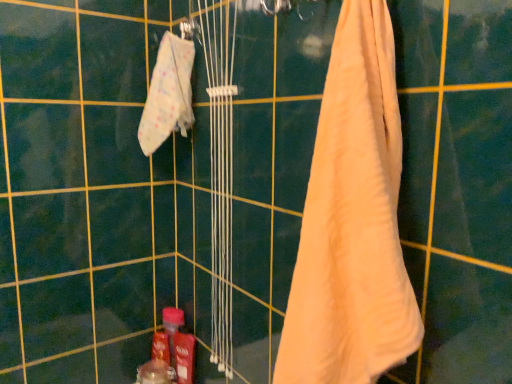
You are a GUI agent. You are given a task and a screenshot of the screen. Output one action in this format:
    pyautogui.click(x=<x>, y=<y>)
    Task: Click on the beige cotton towel at right, the 1th towel positioned from the right
    The image size is (512, 384).
    Given the screenshot: What is the action you would take?
    pyautogui.click(x=352, y=221)

Locate an element on the screen. The image size is (512, 384). white fabric towel at upper left, marked as the 1th towel in a back-to-front arrangement is located at coordinates (168, 94).

At what (x,y) coordinates should I click in order to perform the action: click on translucent plastic bottle at lower center. Please return your answer as a coordinate pair (x, y). The height and width of the screenshot is (384, 512). Looking at the image, I should click on (172, 327).

Measure the distance between point (183, 319) and camera.

Point (183, 319) and camera are 4.82 feet apart.

The image size is (512, 384). I want to click on beige cotton towel at right, which is the second towel in back-to-front order, so click(x=352, y=221).

Considering the relative sizes of beige cotton towel at right, acting as the 1th towel starting from the front, and white fabric towel at upper left, which is the second towel from front to back, in the image provided, is beige cotton towel at right, acting as the 1th towel starting from the front, bigger than white fabric towel at upper left, which is the second towel from front to back,?

Correct, beige cotton towel at right, acting as the 1th towel starting from the front, is larger in size than white fabric towel at upper left, which is the second towel from front to back.

From a real-world perspective, is beige cotton towel at right, acting as the 1th towel starting from the front, on top of white fabric towel at upper left, which is the second towel from front to back?

No, from a real-world perspective, beige cotton towel at right, acting as the 1th towel starting from the front, is not above white fabric towel at upper left, which is the second towel from front to back.

Image resolution: width=512 pixels, height=384 pixels. There is a translucent plastic bottle at lower center. What are the coordinates of `the 2nd towel above it (from a real-world perspective)` in the screenshot? It's located at (168, 94).

Is white fabric towel at upper left, which is the second towel from front to back, with translucent plastic bottle at lower center?

white fabric towel at upper left, which is the second towel from front to back, and translucent plastic bottle at lower center are clearly separated.

Consider the image. Is white fabric towel at upper left, which is the second towel from front to back, situated inside translucent plastic bottle at lower center or outside?

white fabric towel at upper left, which is the second towel from front to back, lies outside translucent plastic bottle at lower center.

Considering the relative sizes of white fabric towel at upper left, marked as the 1th towel in a back-to-front arrangement, and translucent plastic bottle at lower center in the image provided, is white fabric towel at upper left, marked as the 1th towel in a back-to-front arrangement, bigger than translucent plastic bottle at lower center?

Yes.

Who is taller, translucent plastic bottle at lower center or beige cotton towel at right, which is the 2th towel from left to right?

Standing taller between the two is beige cotton towel at right, which is the 2th towel from left to right.

From a real-world perspective, is translucent plastic bottle at lower center on top of beige cotton towel at right, which is the second towel in back-to-front order?

Actually, translucent plastic bottle at lower center is physically below beige cotton towel at right, which is the second towel in back-to-front order, in the real world.

Is translucent plastic bottle at lower center next to beige cotton towel at right, the 1th towel positioned from the right?

No.

Can you tell me how much translucent plastic bottle at lower center and beige cotton towel at right, which is the second towel in back-to-front order, differ in facing direction?

translucent plastic bottle at lower center and beige cotton towel at right, which is the second towel in back-to-front order, are facing 92 degrees away from each other.

In the image, is beige cotton towel at right, acting as the 1th towel starting from the front, positioned in front of or behind translucent plastic bottle at lower center?

Clearly, beige cotton towel at right, acting as the 1th towel starting from the front, is in front of translucent plastic bottle at lower center.

Is beige cotton towel at right, acting as the 1th towel starting from the front, positioned beyond the bounds of translucent plastic bottle at lower center?

beige cotton towel at right, acting as the 1th towel starting from the front, lies outside translucent plastic bottle at lower center's area.

Is beige cotton towel at right, which is the second towel in back-to-front order, positioned far away from translucent plastic bottle at lower center?

No, there isn't a large distance between beige cotton towel at right, which is the second towel in back-to-front order, and translucent plastic bottle at lower center.

Consider the image. Is white fabric towel at upper left, marked as the 1th towel in a back-to-front arrangement, at the right side of beige cotton towel at right, acting as the 1th towel starting from the front?

Incorrect, white fabric towel at upper left, marked as the 1th towel in a back-to-front arrangement, is not on the right side of beige cotton towel at right, acting as the 1th towel starting from the front.

Is white fabric towel at upper left, positioned as the first towel in left-to-right order, not close to beige cotton towel at right, which is the 2th towel from left to right?

No, white fabric towel at upper left, positioned as the first towel in left-to-right order, is in close proximity to beige cotton towel at right, which is the 2th towel from left to right.

Is beige cotton towel at right, which is the 2th towel from left to right, completely or partially inside white fabric towel at upper left, which is the second towel from front to back?

No, beige cotton towel at right, which is the 2th towel from left to right, is not surrounded by white fabric towel at upper left, which is the second towel from front to back.

Is point (160, 88) less distant than point (402, 331)?

No, (160, 88) is further to viewer.

Is translucent plastic bottle at lower center located outside white fabric towel at upper left, marked as the 1th towel in a back-to-front arrangement?

Yes, translucent plastic bottle at lower center is located beyond the bounds of white fabric towel at upper left, marked as the 1th towel in a back-to-front arrangement.

Does translucent plastic bottle at lower center appear on the left side of white fabric towel at upper left, which is the second towel from front to back?

Correct, you'll find translucent plastic bottle at lower center to the left of white fabric towel at upper left, which is the second towel from front to back.

Can you confirm if translucent plastic bottle at lower center is wider than white fabric towel at upper left, the 2th towel when ordered from right to left?

No.

Image resolution: width=512 pixels, height=384 pixels. Find the location of `towel on the right of the white fabric towel at upper left, which is the second towel from front to back`. towel on the right of the white fabric towel at upper left, which is the second towel from front to back is located at coordinates (352, 221).

At what (x,y) coordinates should I click in order to perform the action: click on toiletry that appears below the white fabric towel at upper left, which is the second towel from front to back (from a real-world perspective). Please return your answer as a coordinate pair (x, y). Looking at the image, I should click on (172, 327).

Looking at the image, which one is located closer to translucent plastic bottle at lower center, beige cotton towel at right, acting as the 1th towel starting from the front, or white fabric towel at upper left, marked as the 1th towel in a back-to-front arrangement?

white fabric towel at upper left, marked as the 1th towel in a back-to-front arrangement, is closer to translucent plastic bottle at lower center.

Estimate the real-world distances between objects in this image. Which object is further from beige cotton towel at right, acting as the 1th towel starting from the front, translucent plastic bottle at lower center or white fabric towel at upper left, which is the second towel from front to back?

Based on the image, translucent plastic bottle at lower center appears to be further to beige cotton towel at right, acting as the 1th towel starting from the front.

Based on their spatial positions, is translucent plastic bottle at lower center or beige cotton towel at right, which is the second towel in back-to-front order, closer to white fabric towel at upper left, marked as the 1th towel in a back-to-front arrangement?

The object closer to white fabric towel at upper left, marked as the 1th towel in a back-to-front arrangement, is beige cotton towel at right, which is the second towel in back-to-front order.

Estimate the real-world distances between objects in this image. Which object is further from white fabric towel at upper left, marked as the 1th towel in a back-to-front arrangement, beige cotton towel at right, the 1th towel positioned from the right, or translucent plastic bottle at lower center?

Based on the image, translucent plastic bottle at lower center appears to be further to white fabric towel at upper left, marked as the 1th towel in a back-to-front arrangement.

Based on their spatial positions, is white fabric towel at upper left, the 2th towel when ordered from right to left, or translucent plastic bottle at lower center closer to beige cotton towel at right, which is the second towel in back-to-front order?

The object closer to beige cotton towel at right, which is the second towel in back-to-front order, is white fabric towel at upper left, the 2th towel when ordered from right to left.

From the image, which object appears to be nearer to translucent plastic bottle at lower center, white fabric towel at upper left, positioned as the first towel in left-to-right order, or beige cotton towel at right, which is the second towel in back-to-front order?

white fabric towel at upper left, positioned as the first towel in left-to-right order.

The height and width of the screenshot is (384, 512). Identify the location of towel between beige cotton towel at right, acting as the 1th towel starting from the front, and translucent plastic bottle at lower center in the front-back direction. (168, 94).